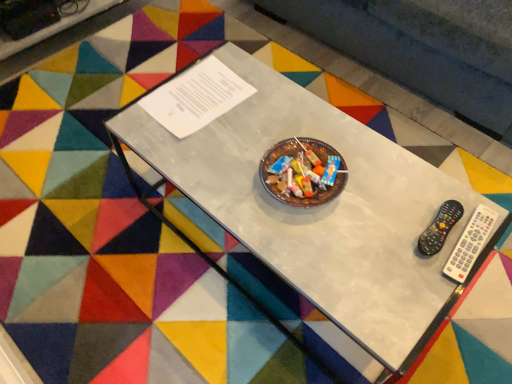
What do you see at coordinates (321, 210) in the screenshot?
I see `metallic glass table at center` at bounding box center [321, 210].

The image size is (512, 384). I want to click on black plastic remote at right, so click(x=440, y=228).

This screenshot has width=512, height=384. What are the coordinates of `metallic glass table at center` in the screenshot? It's located at (321, 210).

From the image's perspective, is black plastic remote at right on top of white plastic remote at right?

Correct, black plastic remote at right appears higher than white plastic remote at right in the image.

Considering the relative sizes of black plastic remote at right and white plastic remote at right in the image provided, is black plastic remote at right wider than white plastic remote at right?

No.

Is black plastic remote at right turned away from white plastic remote at right?

No, black plastic remote at right is not facing the opposite direction of white plastic remote at right.

Is white plastic remote at right shorter than black plastic remote at right?

Yes.

Is white plastic remote at right turned away from black plastic remote at right?

That's not correct — white plastic remote at right is not looking away from black plastic remote at right.

Would you say white plastic remote at right is outside black plastic remote at right?

white plastic remote at right is positioned outside black plastic remote at right.

Considering the positions of point (432, 301) and point (492, 225), is point (432, 301) closer or farther from the camera than point (492, 225)?

Point (432, 301) is positioned closer to the camera compared to point (492, 225).

From the image's perspective, is metallic glass table at center located beneath white plastic remote at right?

No, from the image's perspective, metallic glass table at center is not below white plastic remote at right.

Which is behind, metallic glass table at center or white plastic remote at right?

white plastic remote at right is further away from the camera.

Identify the location of remote control above the metallic glass table at center (from a real-world perspective). (470, 244).

In terms of height, does metallic glass table at center look taller or shorter compared to black plastic remote at right?

Clearly, metallic glass table at center is taller compared to black plastic remote at right.

From the image's perspective, is metallic glass table at center on top of black plastic remote at right?

Yes, from the image's perspective, metallic glass table at center is over black plastic remote at right.

Which object is further away from the camera, metallic glass table at center or black plastic remote at right?

black plastic remote at right is further from the camera.

From a real-world perspective, which object rests below the other?

metallic glass table at center.

From a real-world perspective, which object rests below the other?

metallic glass table at center.

Is white plastic remote at right facing away from metallic glass table at center?

Yes, white plastic remote at right is facing away from metallic glass table at center.

In the scene shown: Is white plastic remote at right beside metallic glass table at center?

white plastic remote at right is not next to metallic glass table at center, and they're not touching.

Between white plastic remote at right and metallic glass table at center, which one is positioned in front?

metallic glass table at center is closer to the camera.

From the image's perspective, is black plastic remote at right located above or below metallic glass table at center?

black plastic remote at right is below metallic glass table at center.

Between black plastic remote at right and metallic glass table at center, which one has more height?

With more height is metallic glass table at center.

Is black plastic remote at right far from metallic glass table at center?

No, black plastic remote at right is not far away from metallic glass table at center.

Is black plastic remote at right aimed at metallic glass table at center?

Yes, black plastic remote at right faces towards metallic glass table at center.

Locate an element on the screen. Image resolution: width=512 pixels, height=384 pixels. remote control on the right of black plastic remote at right is located at coordinates (470, 244).

Locate an element on the screen. remote control located above the black plastic remote at right (from a real-world perspective) is located at coordinates (470, 244).

Which object lies nearer to the anchor point metallic glass table at center, white plastic remote at right or black plastic remote at right?

black plastic remote at right.

From the image, which object appears to be farther from black plastic remote at right, white plastic remote at right or metallic glass table at center?

The object further to black plastic remote at right is metallic glass table at center.

Which object lies nearer to the anchor point black plastic remote at right, metallic glass table at center or white plastic remote at right?

Among the two, white plastic remote at right is located nearer to black plastic remote at right.

Estimate the real-world distances between objects in this image. Which object is further from white plastic remote at right, metallic glass table at center or black plastic remote at right?

Among the two, metallic glass table at center is located further to white plastic remote at right.

Which object lies nearer to the anchor point metallic glass table at center, black plastic remote at right or white plastic remote at right?

black plastic remote at right is closer to metallic glass table at center.

Which object lies nearer to the anchor point white plastic remote at right, black plastic remote at right or metallic glass table at center?

black plastic remote at right is positioned closer to the anchor white plastic remote at right.

I want to click on control located between metallic glass table at center and white plastic remote at right in the left-right direction, so click(x=440, y=228).